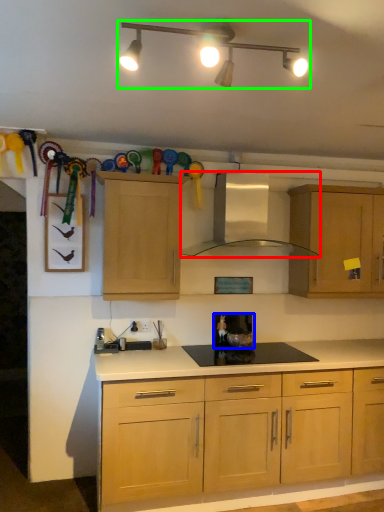
Question: Considering the real-world distances, which object is farthest from kitchen appliance (highlighted by a red box)? appliance (highlighted by a blue box) or light fixture (highlighted by a green box)?

Choices:
 (A) appliance
 (B) light fixture

Answer: (B)